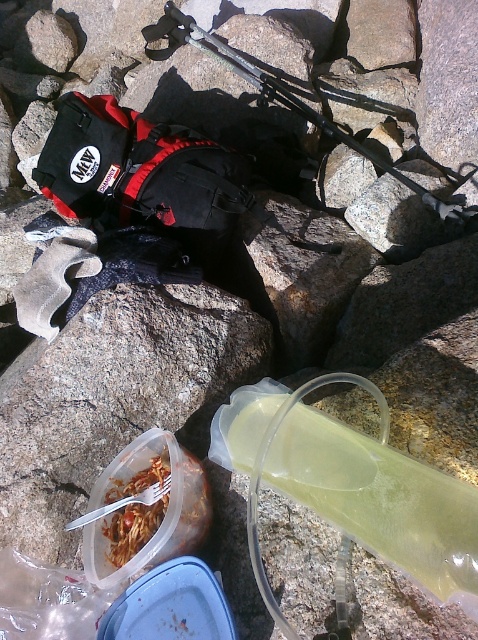
You are a hiker who needs to place a 3.5 feet long tent pole between the black nylon trekking pole at center and the matte plastic container with pasta at lower left. Can you fit it there?

The distance between the black nylon trekking pole at center and the matte plastic container with pasta at lower left is 3.47 feet, which is slightly shorter than the 3.5 feet tent pole. Therefore, the tent pole cannot be placed there without overlapping the objects.